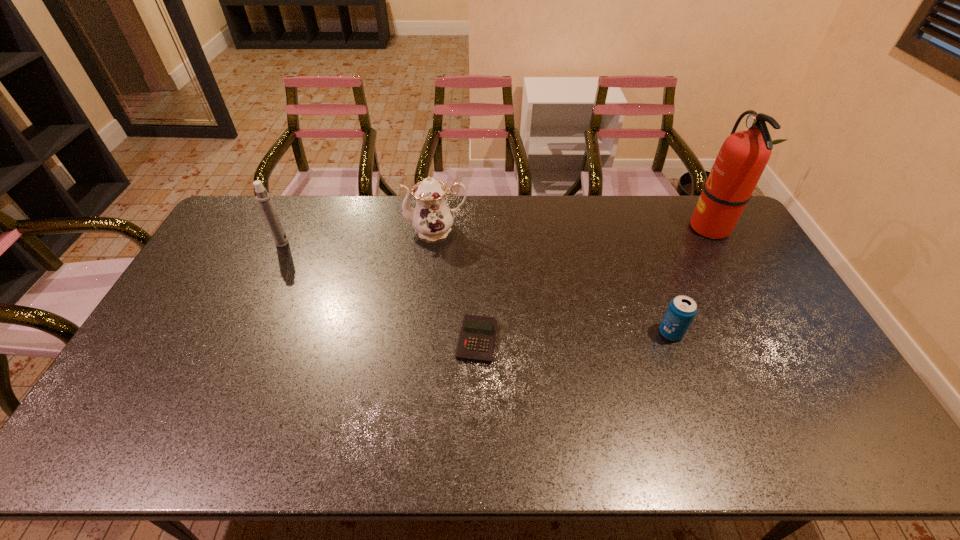
This screenshot has width=960, height=540. I want to click on vacant point located between the fourth tallest object and the rightmost object, so click(690, 280).

The width and height of the screenshot is (960, 540). In order to click on unoccupied position between the tallest object and the calculator in this screenshot , I will do `click(593, 283)`.

Locate an element on the screen. The width and height of the screenshot is (960, 540). object that is the second nearest to the chinaware is located at coordinates pos(263,198).

At what (x,y) coordinates should I click in order to perform the action: click on object that is the third nearest to the chinaware. Please return your answer as a coordinate pair (x, y). Looking at the image, I should click on (681, 311).

You are a GUI agent. You are given a task and a screenshot of the screen. Output one action in this format:
    pyautogui.click(x=<x>, y=<y>)
    Task: Click on the vacant space that satisfies the following two spatial constraints: 1. on the front side of the aerosol can; 2. on the right side of the shortest object
    The height and width of the screenshot is (540, 960).
    Given the screenshot: What is the action you would take?
    pyautogui.click(x=237, y=340)

Locate an element on the screen. The width and height of the screenshot is (960, 540). free region that satisfies the following two spatial constraints: 1. on the front side of the soda can; 2. on the right side of the chinaware is located at coordinates (425, 333).

At what (x,y) coordinates should I click in order to perform the action: click on blank space that satisfies the following two spatial constraints: 1. on the back side of the leftmost object; 2. on the right side of the chinaware. Please return your answer as a coordinate pair (x, y). The height and width of the screenshot is (540, 960). Looking at the image, I should click on (288, 230).